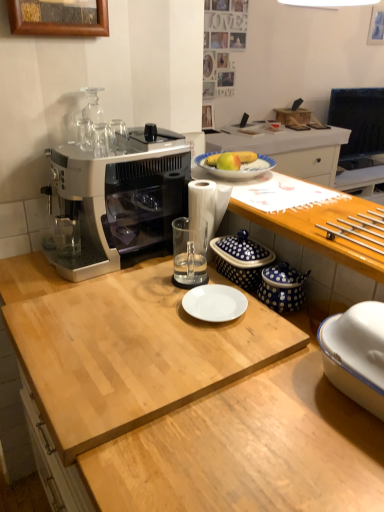
Question: Is blue dotted ceramic jars at right, positioned as the 2th appliance in back-to-front order, in contact with yellow matte apple at center?

Choices:
 (A) yes
 (B) no

Answer: (B)

Question: Does blue dotted ceramic jars at right, which appears as the first appliance when viewed from the front, have a lesser width compared to yellow matte apple at center?

Choices:
 (A) no
 (B) yes

Answer: (A)

Question: Is blue dotted ceramic jars at right, which appears as the first appliance when viewed from the front, oriented towards yellow matte apple at center?

Choices:
 (A) yes
 (B) no

Answer: (B)

Question: From the image's perspective, is blue dotted ceramic jars at right, positioned as the 2th appliance in back-to-front order, beneath yellow matte apple at center?

Choices:
 (A) no
 (B) yes

Answer: (B)

Question: Can yellow matte apple at center be found inside blue dotted ceramic jars at right, positioned as the 2th appliance in back-to-front order?

Choices:
 (A) yes
 (B) no

Answer: (B)

Question: Is wooden at upper right, the 2th desk in the bottom-to-top sequence, in front of or behind yellow matte apple at center in the image?

Choices:
 (A) behind
 (B) front

Answer: (B)

Question: From the image's perspective, relative to yellow matte apple at center, is wooden at upper right, the 2th desk in the bottom-to-top sequence, above or below?

Choices:
 (A) above
 (B) below

Answer: (B)

Question: Do you think wooden at upper right, the 2th desk in the bottom-to-top sequence, is within yellow matte apple at center, or outside of it?

Choices:
 (A) outside
 (B) inside

Answer: (A)

Question: Is point (296, 224) closer or farther from the camera than point (240, 164)?

Choices:
 (A) closer
 (B) farther

Answer: (A)

Question: From the image's perspective, relative to black glossy television at upper right, is metallic silver drawer handles at right, positioned as the third tableware in left-to-right order, above or below?

Choices:
 (A) above
 (B) below

Answer: (B)

Question: Is metallic silver drawer handles at right, the 2th tableware when ordered from top to bottom, wider or thinner than black glossy television at upper right?

Choices:
 (A) thin
 (B) wide

Answer: (B)

Question: From a real-world perspective, relative to black glossy television at upper right, is metallic silver drawer handles at right, which appears as the second tableware when ordered from the bottom, vertically above or below?

Choices:
 (A) above
 (B) below

Answer: (A)

Question: Is point (337, 219) closer or farther from the camera than point (375, 110)?

Choices:
 (A) closer
 (B) farther

Answer: (A)

Question: From the image's perspective, is transparent glass at center, the 2th tableware positioned from the left, positioned above or below blue polka dot ceramic container at center, positioned as the first appliance in back-to-front order?

Choices:
 (A) above
 (B) below

Answer: (B)

Question: From a real-world perspective, is transparent glass at center, placed as the third tableware when sorted from top to bottom, above or below blue polka dot ceramic container at center, positioned as the first appliance in back-to-front order?

Choices:
 (A) below
 (B) above

Answer: (B)